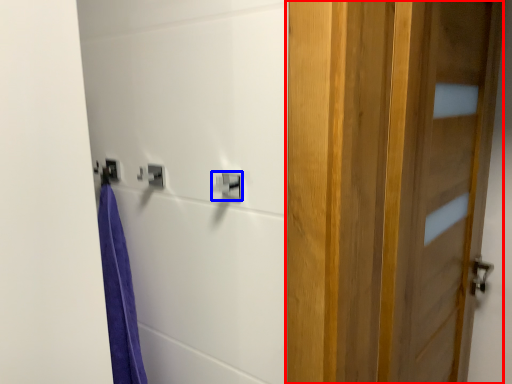
Question: Among these objects, which one is farthest to the camera, door (highlighted by a red box) or lock (highlighted by a blue box)?

Choices:
 (A) door
 (B) lock

Answer: (B)